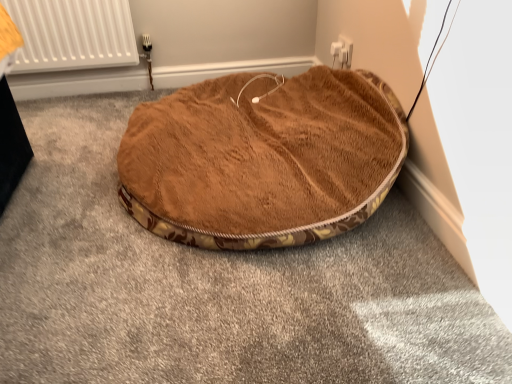
Question: Choose the correct answer: Is white plastic electric outlet at upper center inside brown plush dog bed at center or outside it?

Choices:
 (A) outside
 (B) inside

Answer: (A)

Question: Based on their sizes in the image, would you say white plastic electric outlet at upper center is bigger or smaller than brown plush dog bed at center?

Choices:
 (A) big
 (B) small

Answer: (B)

Question: From a real-world perspective, relative to brown plush dog bed at center, is white plastic electric outlet at upper center vertically above or below?

Choices:
 (A) above
 (B) below

Answer: (A)

Question: From a real-world perspective, is brown plush dog bed at center physically located above or below white plastic electric outlet at upper center?

Choices:
 (A) below
 (B) above

Answer: (A)

Question: Considering the positions of brown plush dog bed at center and white plastic electric outlet at upper center in the image, is brown plush dog bed at center bigger or smaller than white plastic electric outlet at upper center?

Choices:
 (A) small
 (B) big

Answer: (B)

Question: Is point (239, 79) closer or farther from the camera than point (335, 59)?

Choices:
 (A) farther
 (B) closer

Answer: (B)

Question: Would you say brown plush dog bed at center is to the left or to the right of white plastic electric outlet at upper center in the picture?

Choices:
 (A) right
 (B) left

Answer: (B)